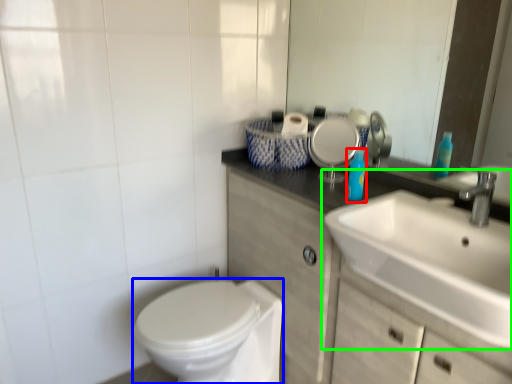
Question: Estimate the real-world distances between objects in this image. Which object is closer to toiletry (highlighted by a red box), bidet (highlighted by a blue box) or sink (highlighted by a green box)?

Choices:
 (A) bidet
 (B) sink

Answer: (B)